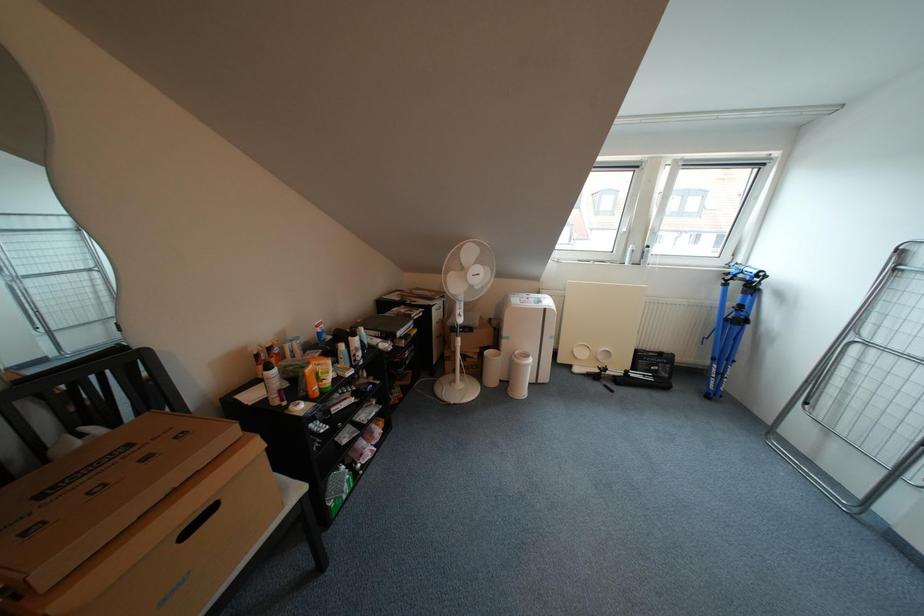
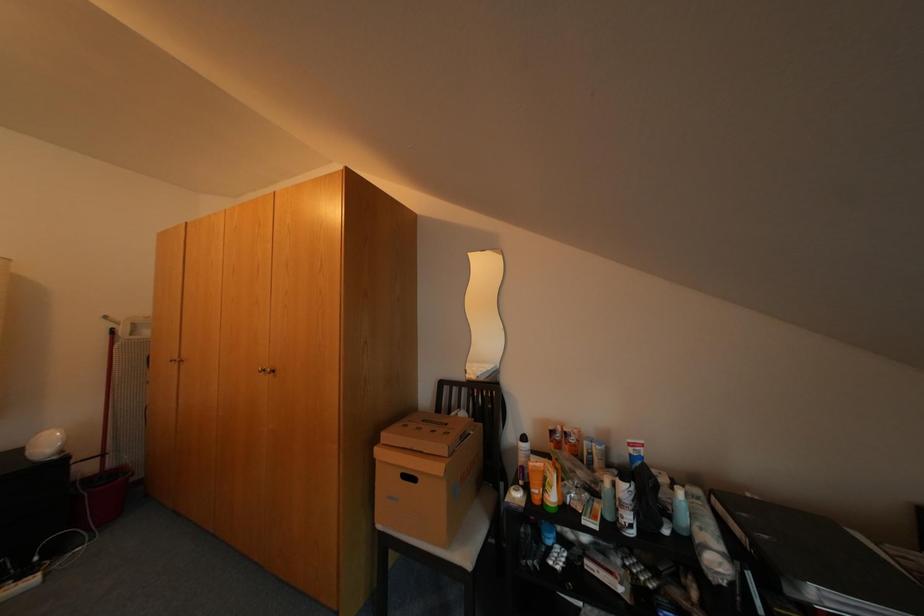
Question: How did the camera likely rotate?

Choices:
 (A) Left
 (B) Right
 (C) Up
 (D) Down

Answer: (A)